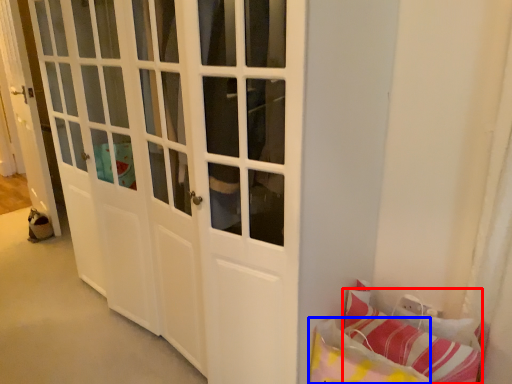
Question: Which point is closer to the camera, pillow (highlighted by a red box) or pillow (highlighted by a blue box)?

Choices:
 (A) pillow
 (B) pillow

Answer: (B)